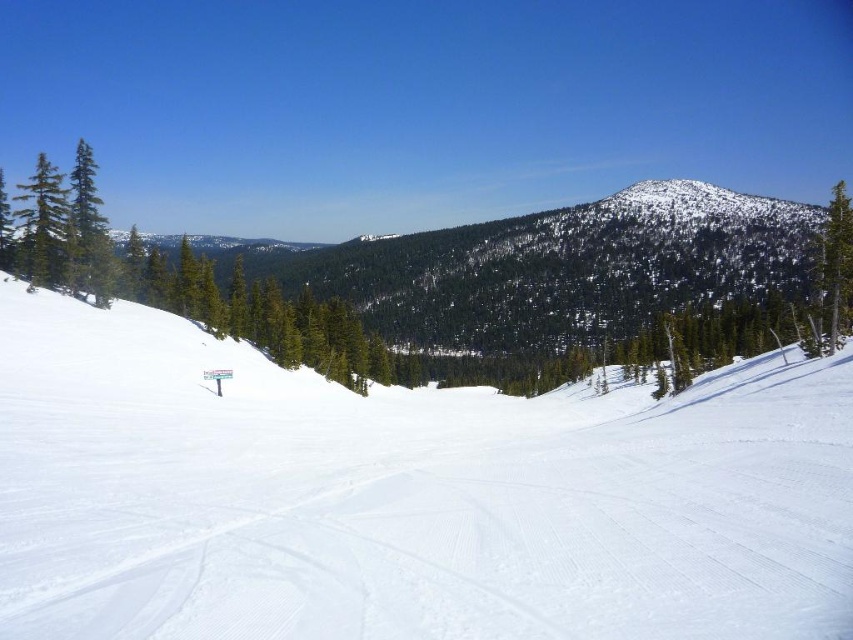
Question: Which point appears farthest from the camera in this image?

Choices:
 (A) (135, 436)
 (B) (670, 280)
 (C) (837, 273)
 (D) (91, 282)

Answer: (B)

Question: In this image, where is green matte tree at upper left located relative to green matte tree at right?

Choices:
 (A) above
 (B) below

Answer: (B)

Question: Does white smooth snow at center lie behind green textured pine at center?

Choices:
 (A) no
 (B) yes

Answer: (A)

Question: Considering the real-world distances, which object is closest to the white smooth snow at center?

Choices:
 (A) green matte tree at right
 (B) green matte tree at upper left

Answer: (B)

Question: Which object is the farthest from the green textured pine at center?

Choices:
 (A) white smooth snow at center
 (B) green matte tree at upper left
 (C) green matte tree at right

Answer: (B)

Question: Does white smooth snow at center have a greater width compared to green matte tree at right?

Choices:
 (A) no
 (B) yes

Answer: (A)